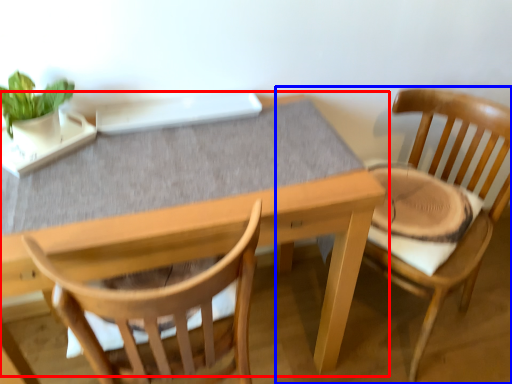
Question: Which object is further to the camera taking this photo, table (highlighted by a red box) or chair (highlighted by a blue box)?

Choices:
 (A) table
 (B) chair

Answer: (B)